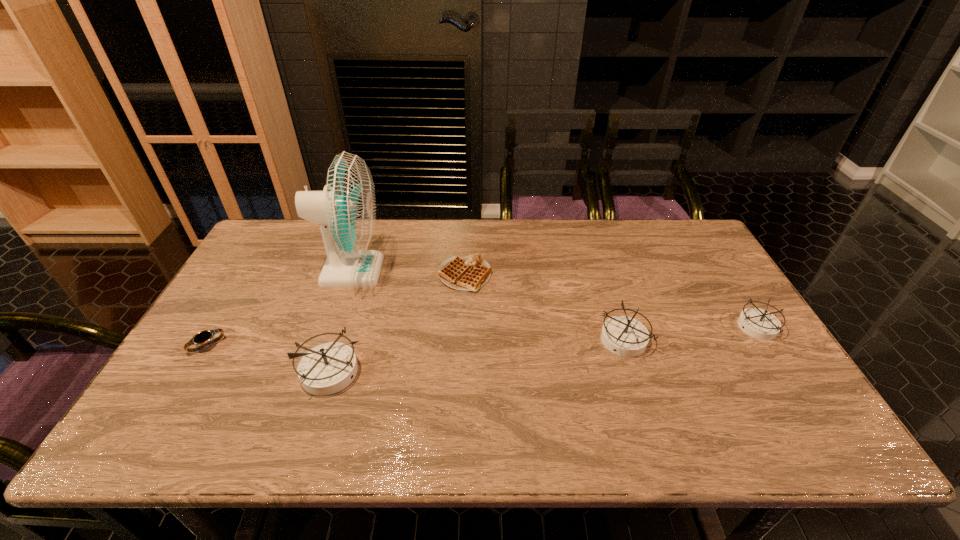
Image resolution: width=960 pixels, height=540 pixels. Identify the location of the leftmost compass. (327, 368).

Where is `the second object from right to left`? The width and height of the screenshot is (960, 540). the second object from right to left is located at coordinates (624, 336).

The image size is (960, 540). I want to click on the third tallest object, so click(x=624, y=336).

The width and height of the screenshot is (960, 540). In order to click on the third shortest object in this screenshot , I will do `click(758, 323)`.

The width and height of the screenshot is (960, 540). Find the location of `the rightmost object`. the rightmost object is located at coordinates (758, 323).

The width and height of the screenshot is (960, 540). In order to click on watch in this screenshot , I will do `click(203, 337)`.

The height and width of the screenshot is (540, 960). Find the location of `the tallest object`. the tallest object is located at coordinates (345, 210).

Find the location of a particular element. waffle is located at coordinates (470, 273).

Identify the location of vacant space located 0.400m on the right of the leftmost compass. (522, 370).

The image size is (960, 540). In order to click on vacant space located 0.060m on the right of the second compass from right to left in this screenshot , I will do [670, 341].